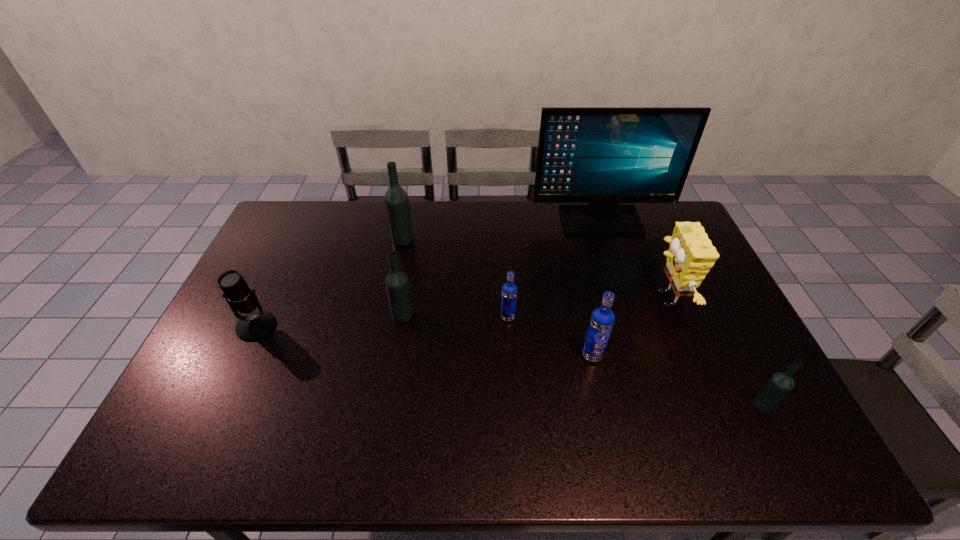
Locate an element on the screen. The height and width of the screenshot is (540, 960). vacant region at the far edge of the desktop is located at coordinates (445, 223).

In the image, there is a desktop. Where is `free region at the near edge`? The height and width of the screenshot is (540, 960). free region at the near edge is located at coordinates (255, 464).

Find the location of a particular element. Image resolution: width=960 pixels, height=540 pixels. free space at the left edge is located at coordinates (271, 263).

In the image, there is a desktop. Where is `free space at the right edge`? The image size is (960, 540). free space at the right edge is located at coordinates (729, 324).

Find the location of a particular element. vacant space at the far right corner of the desktop is located at coordinates (668, 231).

In the image, there is a desktop. Where is `blank space at the near right corner`? The height and width of the screenshot is (540, 960). blank space at the near right corner is located at coordinates (801, 435).

Find the location of a particular element. vacant region between the black monitor and the tallest vodka is located at coordinates (501, 230).

Image resolution: width=960 pixels, height=540 pixels. In order to click on free area in between the yellow sponge and the nearest vodka in this screenshot , I will do coord(714,352).

Where is `vacant space that's between the monitor and the second farthest black vodka`? The image size is (960, 540). vacant space that's between the monitor and the second farthest black vodka is located at coordinates (501, 267).

Locate an element on the screen. This screenshot has height=540, width=960. free spot between the rightmost black vodka and the seventh shortest object is located at coordinates (583, 322).